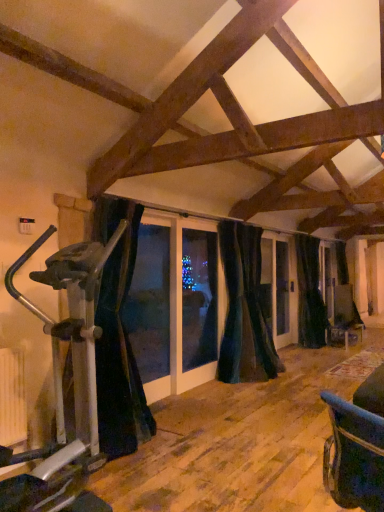
Question: Does dark velvet curtain at center, the second curtain viewed from the front, lie in front of silver metallic stationary bicycle at left?

Choices:
 (A) yes
 (B) no

Answer: (B)

Question: Does dark velvet curtain at center, the second curtain viewed from the left, appear on the right side of silver metallic stationary bicycle at left?

Choices:
 (A) yes
 (B) no

Answer: (A)

Question: From a real-world perspective, is dark velvet curtain at center, the second curtain viewed from the front, over silver metallic stationary bicycle at left?

Choices:
 (A) no
 (B) yes

Answer: (B)

Question: Considering the relative sizes of dark velvet curtain at center, the second curtain viewed from the left, and silver metallic stationary bicycle at left in the image provided, is dark velvet curtain at center, the second curtain viewed from the left, thinner than silver metallic stationary bicycle at left?

Choices:
 (A) yes
 (B) no

Answer: (A)

Question: Would you consider dark velvet curtain at center, the second curtain in the back-to-front sequence, to be distant from silver metallic stationary bicycle at left?

Choices:
 (A) no
 (B) yes

Answer: (B)

Question: Looking at their shapes, would you say black fabric curtain at left, placed as the 1th curtain when sorted from left to right, is wider or thinner than black velvet curtain at right, the first curtain positioned from the back?

Choices:
 (A) thin
 (B) wide

Answer: (B)

Question: From a real-world perspective, relative to black velvet curtain at right, the third curtain when ordered from front to back, is black fabric curtain at left, which appears as the first curtain when viewed from the front, vertically above or below?

Choices:
 (A) below
 (B) above

Answer: (B)

Question: Relative to black velvet curtain at right, the 3th curtain positioned from the left, is black fabric curtain at left, positioned as the third curtain in right-to-left order, in front or behind?

Choices:
 (A) behind
 (B) front

Answer: (B)

Question: Considering the positions of black fabric curtain at left, the 3th curtain in the back-to-front sequence, and black velvet curtain at right, the first curtain from the right, in the image, is black fabric curtain at left, the 3th curtain in the back-to-front sequence, taller or shorter than black velvet curtain at right, the first curtain from the right,?

Choices:
 (A) tall
 (B) short

Answer: (B)

Question: From the image's perspective, is black velvet curtain at right, the first curtain from the right, located above or below dark velvet curtain at center, which is the second curtain from right to left?

Choices:
 (A) below
 (B) above

Answer: (A)

Question: From a real-world perspective, relative to dark velvet curtain at center, the second curtain viewed from the front, is black velvet curtain at right, the first curtain positioned from the back, vertically above or below?

Choices:
 (A) below
 (B) above

Answer: (A)

Question: Relative to dark velvet curtain at center, the second curtain viewed from the front, is black velvet curtain at right, the 3th curtain positioned from the left, in front or behind?

Choices:
 (A) front
 (B) behind

Answer: (B)

Question: Is point (317, 293) positioned closer to the camera than point (221, 369)?

Choices:
 (A) closer
 (B) farther

Answer: (B)

Question: Does point pyautogui.click(x=254, y=339) appear closer or farther from the camera than point pyautogui.click(x=87, y=317)?

Choices:
 (A) closer
 (B) farther

Answer: (B)

Question: Is dark velvet curtain at center, the second curtain in the back-to-front sequence, bigger or smaller than silver metallic stationary bicycle at left?

Choices:
 (A) small
 (B) big

Answer: (A)